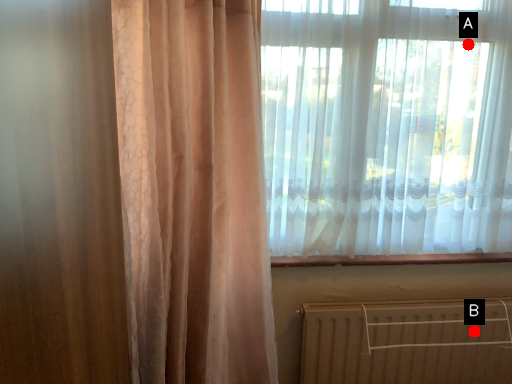
Question: Two points are circled on the image, labeled by A and B beside each circle. Which point appears farthest from the camera in this image?

Choices:
 (A) A is further
 (B) B is further

Answer: (B)